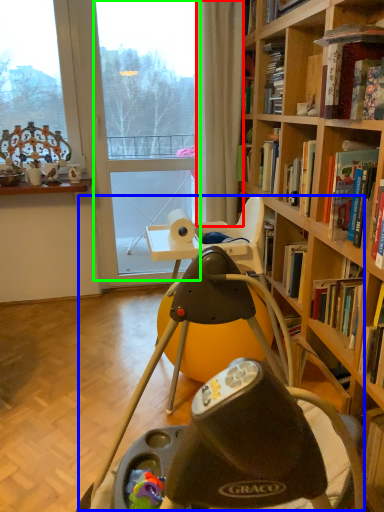
Question: Considering the real-world distances, which object is closest to curtain (highlighted by a red box)? swivel chair (highlighted by a blue box) or glass door (highlighted by a green box).

Choices:
 (A) swivel chair
 (B) glass door

Answer: (B)